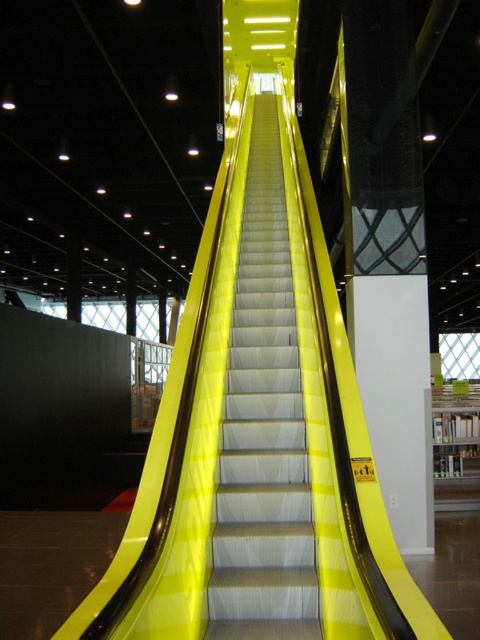
Is yellow glossy escalator at center smaller than white glossy pillar at center?

No.

In the scene shown: Does yellow glossy escalator at center have a greater width compared to white glossy pillar at center?

In fact, yellow glossy escalator at center might be narrower than white glossy pillar at center.

Is point (248, 600) less distant than point (348, 186)?

Yes, point (248, 600) is in front of point (348, 186).

Image resolution: width=480 pixels, height=640 pixels. What are the coordinates of `yellow glossy escalator at center` in the screenshot? It's located at (264, 426).